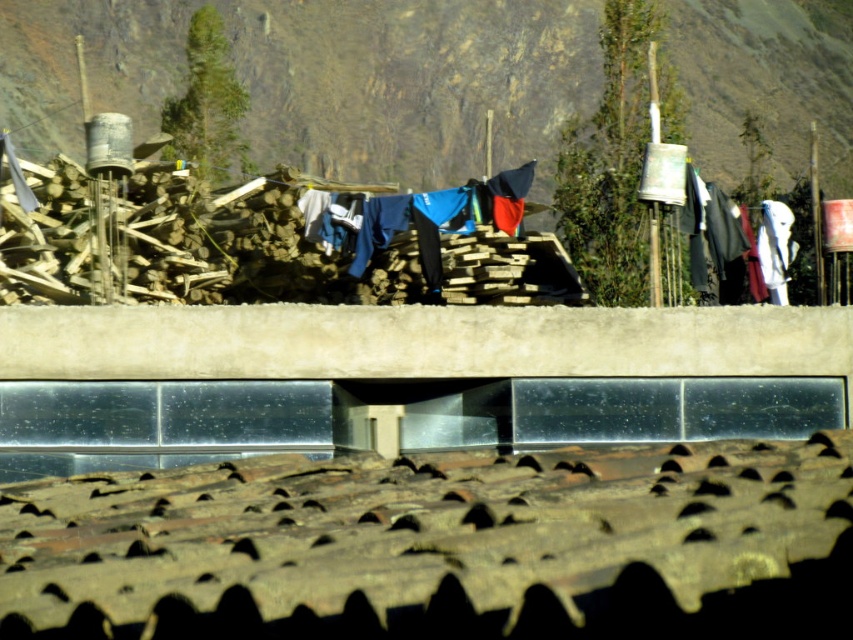
Question: Is rugged rock mountain at upper center thinner than blue fabric clothes at center?

Choices:
 (A) yes
 (B) no

Answer: (B)

Question: Is rugged rock mountain at upper center closer to camera compared to blue fabric clothes at center?

Choices:
 (A) yes
 (B) no

Answer: (B)

Question: Can you confirm if rusty metal tile roof at lower center is positioned to the right of blue fabric clothes at center?

Choices:
 (A) yes
 (B) no

Answer: (A)

Question: Which point is farther to the camera?

Choices:
 (A) blue fabric clothes at center
 (B) rugged rock mountain at upper center
 (C) rusty metal tile roof at lower center

Answer: (B)

Question: Which object is the farthest from the blue fabric clothes at center?

Choices:
 (A) rusty metal tile roof at lower center
 (B) rugged rock mountain at upper center

Answer: (B)

Question: Which point is closer to the camera?

Choices:
 (A) (408, 204)
 (B) (80, 131)

Answer: (A)